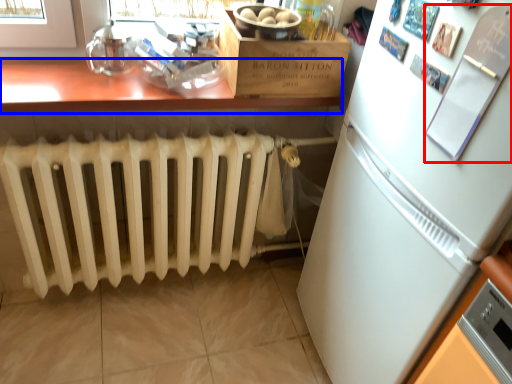
Question: Which object appears closest to the camera in this image, bulletin board (highlighted by a red box) or table (highlighted by a blue box)?

Choices:
 (A) bulletin board
 (B) table

Answer: (A)